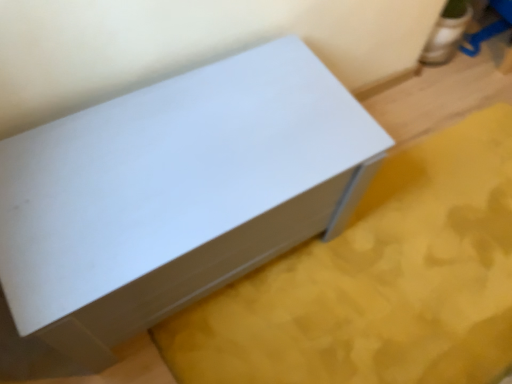
You are a GUI agent. You are given a task and a screenshot of the screen. Output one action in this format:
    pyautogui.click(x=<x>, y=<y>)
    Task: Click on the white matte table at center
    The width and height of the screenshot is (512, 384).
    Given the screenshot: What is the action you would take?
    pyautogui.click(x=175, y=194)

Describe the element at coordinates (175, 194) in the screenshot. The width and height of the screenshot is (512, 384). I see `white matte table at center` at that location.

Locate an element on the screen. Image resolution: width=512 pixels, height=384 pixels. white matte table at center is located at coordinates (175, 194).